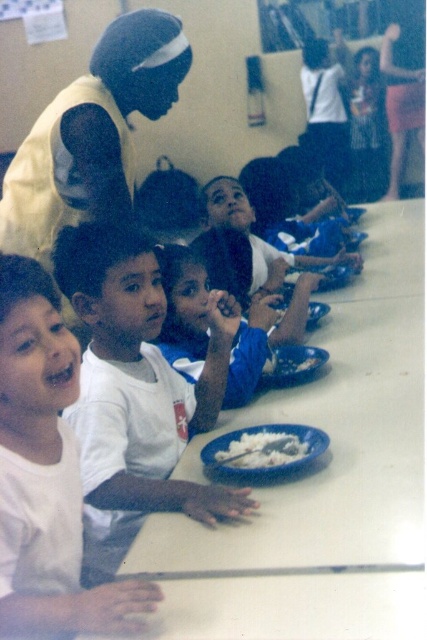
From the picture: You are a photographer standing at the back of the room. You want to take a picture of the blue jersey at center. Where should you aim your camera to capture it?

You should aim your camera at point 0.484 on the horizontal axis and point 0.431 on the vertical axis to capture the blue jersey at center.

You are a teacher standing at the front of the classroom. You want to pass out a sticker to the child wearing the white matte shirt at left and the child with the blue plastic plate at center. If your reach is 30 inches, can you hand both children the stickers without moving closer?

The white matte shirt at left is 32.08 inches from the blue plastic plate at center. Since the distance between them is greater than your 30 inch reach, you cannot reach both children at the same time without moving closer.

You are a teacher observing the children during lunchtime. You notice the white matte shirt at left and the blue plastic plate at center. Which object is closer to you?

The white matte shirt at left is closer to you because it is in front of the blue plastic plate at center.